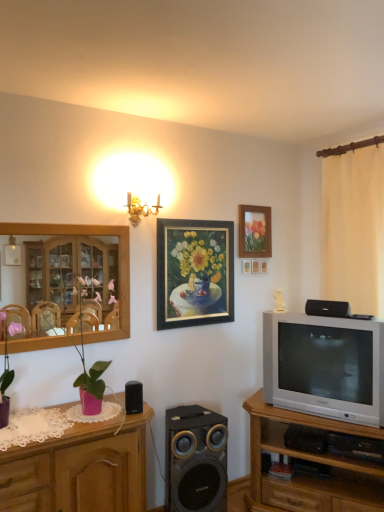
Question: Which direction should I rotate to face gold-framed painting at center, placed as the 3th picture frame when sorted from right to left, — up or down?

Choices:
 (A) up
 (B) down

Answer: (B)

Question: From a real-world perspective, is black matte speaker at lower center, which is the 2th speaker in bottom-to-top order, over matte purple pot at left, the 1th plant when ordered from left to right?

Choices:
 (A) no
 (B) yes

Answer: (A)

Question: Could matte purple pot at left, the 1th plant when ordered from left to right, be considered to be inside black matte speaker at lower center, which is the 2th speaker in bottom-to-top order?

Choices:
 (A) yes
 (B) no

Answer: (B)

Question: From the image's perspective, would you say black matte speaker at lower center, which is the 2th speaker in top-to-bottom order, is positioned over matte purple pot at left, which ranks as the second plant in right-to-left order?

Choices:
 (A) no
 (B) yes

Answer: (A)

Question: Would you say black matte speaker at lower center, which is the 2th speaker in top-to-bottom order, is outside matte purple pot at left, which ranks as the second plant in right-to-left order?

Choices:
 (A) no
 (B) yes

Answer: (B)

Question: Is black matte speaker at lower center, which is the 2th speaker in top-to-bottom order, further to the viewer compared to matte purple pot at left, the 1th plant when ordered from left to right?

Choices:
 (A) no
 (B) yes

Answer: (B)

Question: Can you confirm if black matte speaker at lower center, positioned as the 1th speaker in left-to-right order, is wider than matte purple pot at left, the 1th plant when ordered from left to right?

Choices:
 (A) no
 (B) yes

Answer: (A)

Question: Considering the relative sizes of pink matte vase at left, which is counted as the 2th plant, starting from the left, and wooden cabinet at left in the image provided, is pink matte vase at left, which is counted as the 2th plant, starting from the left, smaller than wooden cabinet at left?

Choices:
 (A) yes
 (B) no

Answer: (B)

Question: Considering the relative positions of pink matte vase at left, which is counted as the 2th plant, starting from the left, and wooden cabinet at left in the image provided, is pink matte vase at left, which is counted as the 2th plant, starting from the left, to the left of wooden cabinet at left from the viewer's perspective?

Choices:
 (A) yes
 (B) no

Answer: (B)

Question: Are pink matte vase at left, placed as the first plant when sorted from right to left, and wooden cabinet at left far apart?

Choices:
 (A) yes
 (B) no

Answer: (B)

Question: From a real-world perspective, is pink matte vase at left, placed as the first plant when sorted from right to left, located beneath wooden cabinet at left?

Choices:
 (A) yes
 (B) no

Answer: (A)

Question: Is pink matte vase at left, placed as the first plant when sorted from right to left, turned away from wooden cabinet at left?

Choices:
 (A) no
 (B) yes

Answer: (B)

Question: From the image's perspective, would you say pink matte vase at left, placed as the first plant when sorted from right to left, is positioned over wooden cabinet at left?

Choices:
 (A) yes
 (B) no

Answer: (B)

Question: From a real-world perspective, is pink matte vase at left, which is counted as the 2th plant, starting from the left, positioned over pink wood cabinet at left, which ranks as the 1th cabinetry in left-to-right order, based on gravity?

Choices:
 (A) no
 (B) yes

Answer: (B)